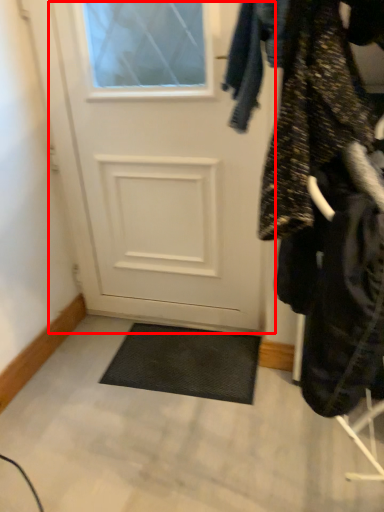
Question: From the image's perspective, what is the correct spatial relationship of door (annotated by the red box) in relation to closet?

Choices:
 (A) below
 (B) above

Answer: (B)